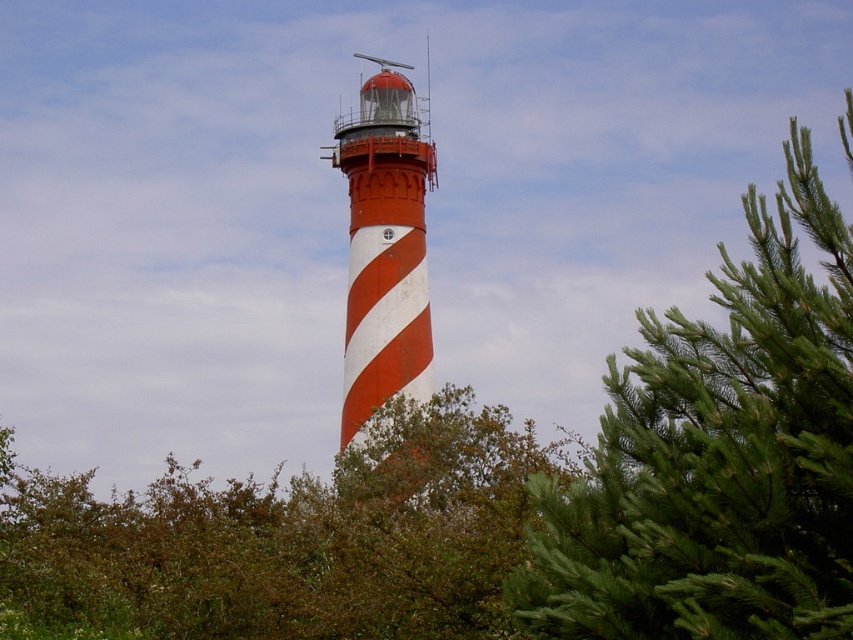
In the scene shown: Between green needle-like at right and green leafy tree at center, which one is positioned higher?

green needle-like at right is above.

Measure the distance between green needle-like at right and green leafy tree at center.

The distance of green needle-like at right from green leafy tree at center is 18.09 meters.

Who is more distant from viewer, (782, 227) or (135, 518)?

Point (135, 518)

The height and width of the screenshot is (640, 853). What are the coordinates of `green needle-like at right` in the screenshot? It's located at (717, 456).

Between point (527, 508) and point (352, 356), which one is positioned behind?

The point (352, 356) is more distant.

Is point (171, 524) closer to viewer compared to point (352, 413)?

That is False.

Identify the location of green leafy tree at center. (287, 538).

What do you see at coordinates (717, 456) in the screenshot?
I see `green needle-like at right` at bounding box center [717, 456].

Does point (659, 339) lie in front of point (369, 230)?

Yes, point (659, 339) is closer to viewer.

Between point (612, 476) and point (419, 294), which one is positioned behind?

The point (419, 294) is behind.

This screenshot has height=640, width=853. In order to click on green needle-like at right in this screenshot , I will do `click(717, 456)`.